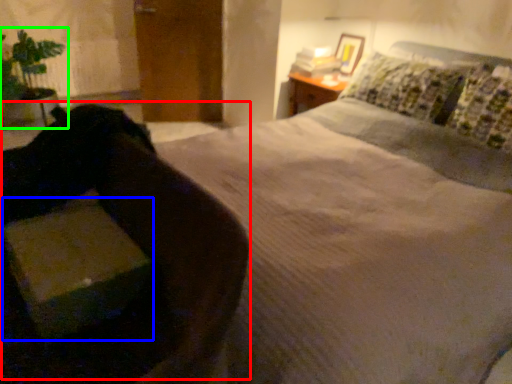
Question: Which is nearer to the swivel chair (highlighted by a red box)? cardboard box (highlighted by a blue box) or houseplant (highlighted by a green box).

Choices:
 (A) cardboard box
 (B) houseplant

Answer: (A)